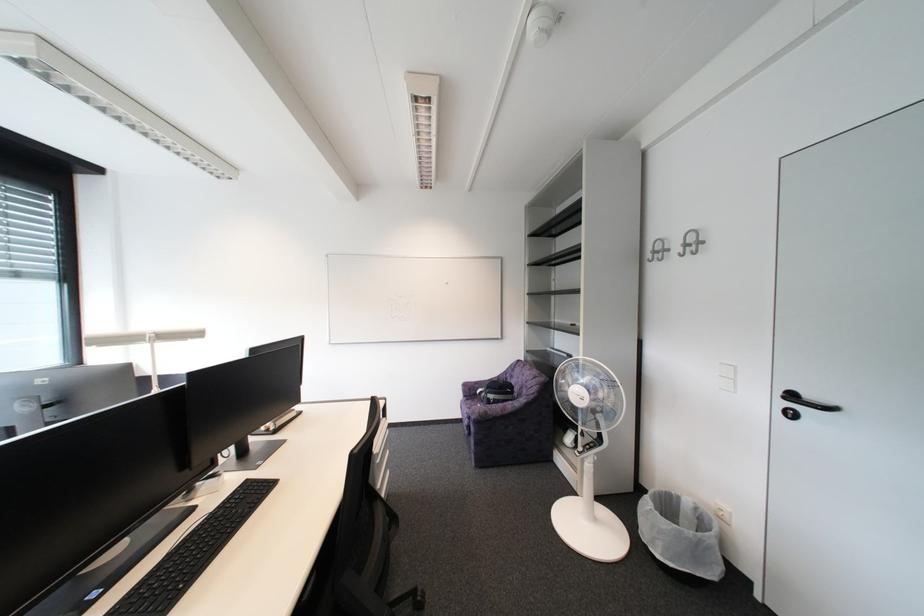
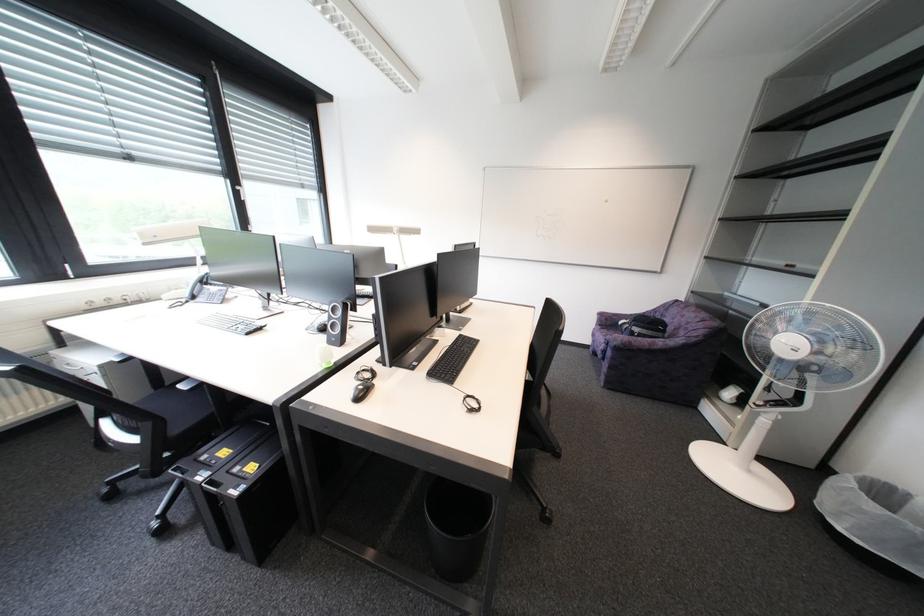
How did the camera likely rotate?

The rotation direction of the camera is left-down.